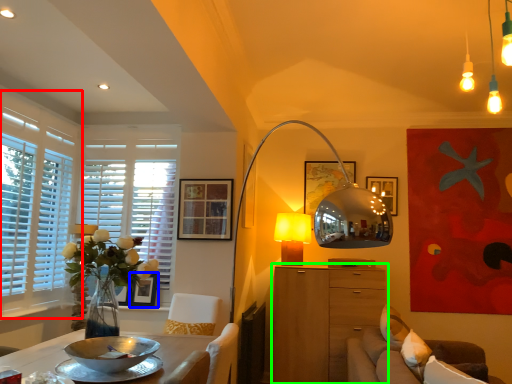
Question: Based on their relative distances, which object is nearer to window (highlighted by a red box)? Choose from picture frame (highlighted by a blue box) and cabinetry (highlighted by a green box).

Choices:
 (A) picture frame
 (B) cabinetry

Answer: (A)